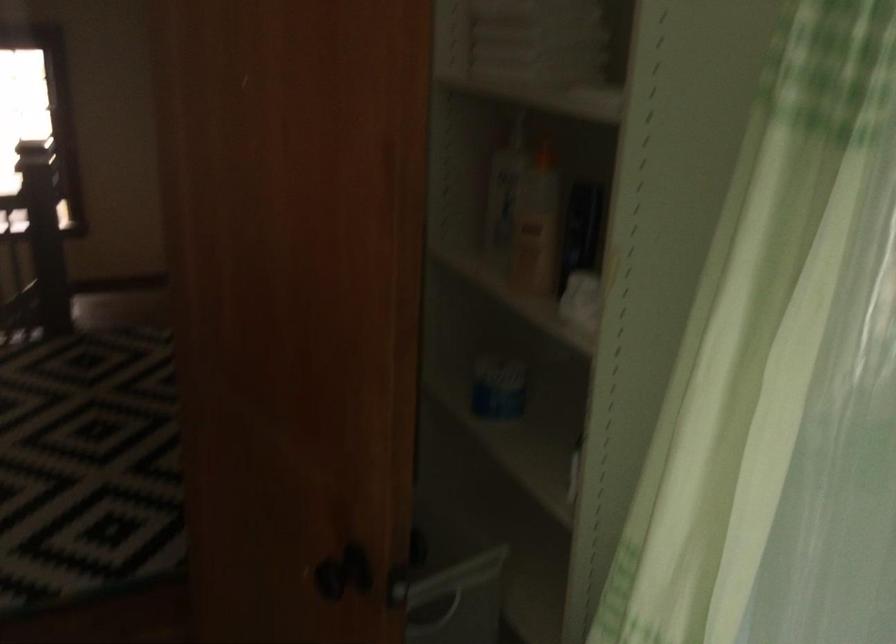
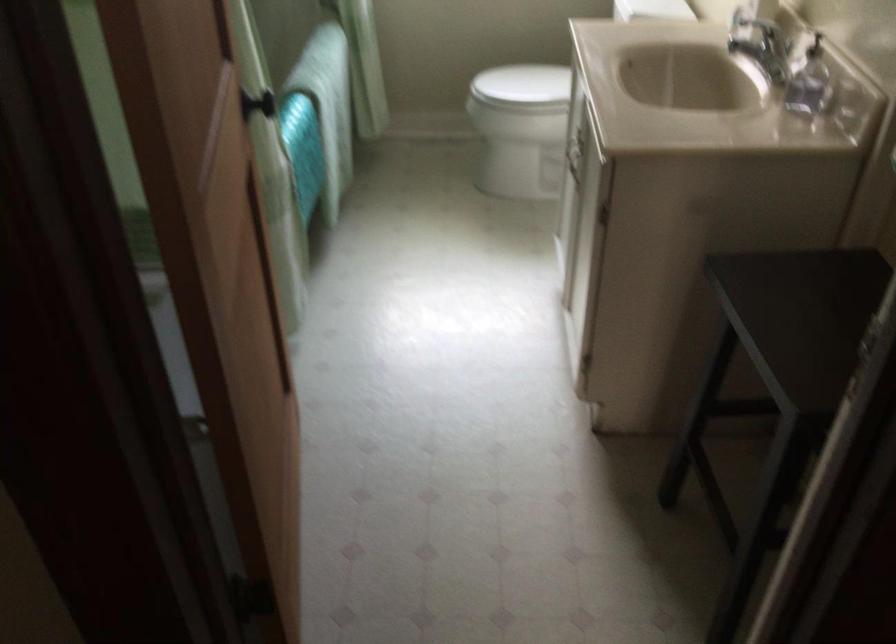
Question: I am providing you with two images of the same scene from different viewpoints. Which of the following objects are not visible in image2?

Choices:
 (A) whiteboard magnet
 (B) dark stool
 (C) black door knob
 (D) soap dispenser pump

Answer: (C)